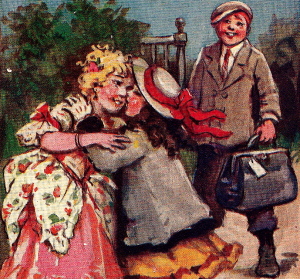
Where is `coat`? coat is located at coordinates (157, 189).